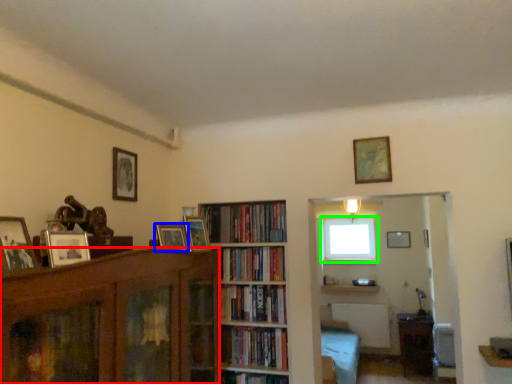
Question: Considering the real-world distances, which object is closest to bookcase (highlighted by a red box)? picture frame (highlighted by a blue box) or window (highlighted by a green box).

Choices:
 (A) picture frame
 (B) window

Answer: (A)